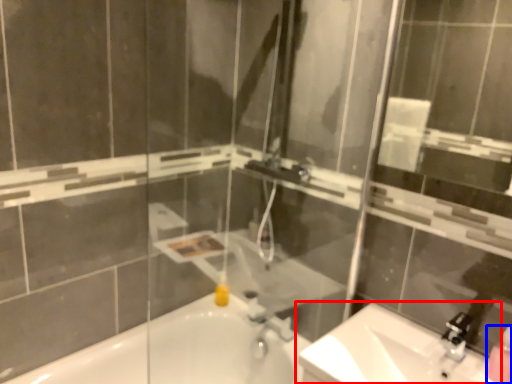
Question: Which point is further to the camera, sink (highlighted by a red box) or soap dispenser (highlighted by a blue box)?

Choices:
 (A) sink
 (B) soap dispenser

Answer: (B)